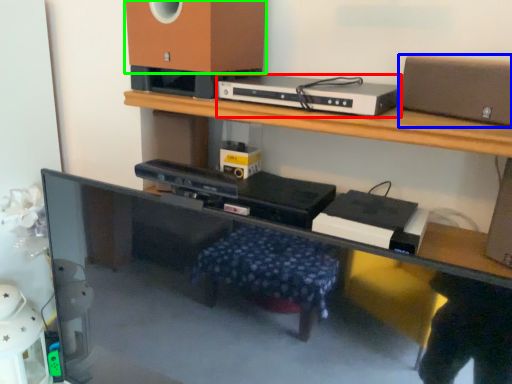
Question: Which object is the farthest from gadget (highlighted by a red box)? Choose among these: speaker (highlighted by a blue box) or speaker (highlighted by a green box).

Choices:
 (A) speaker
 (B) speaker

Answer: (A)